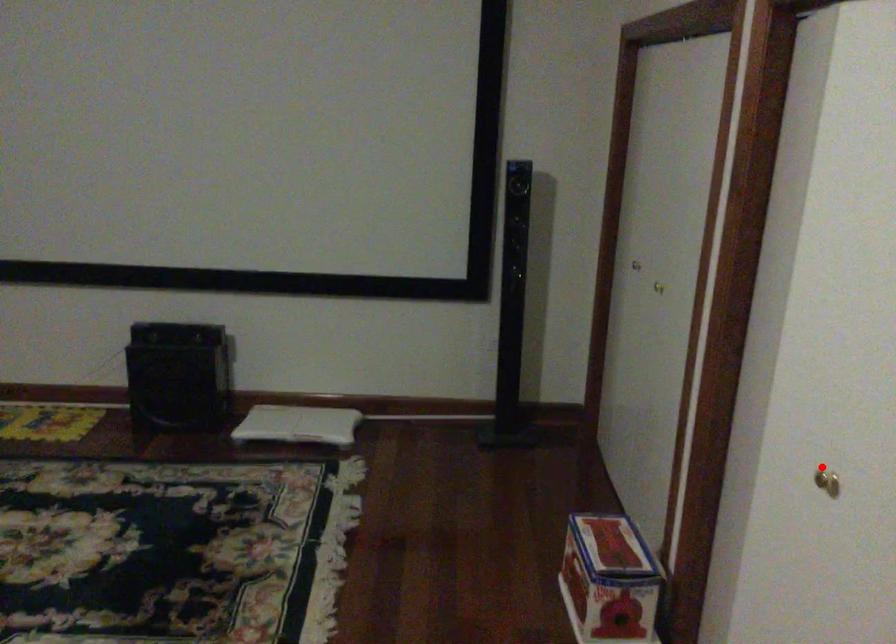
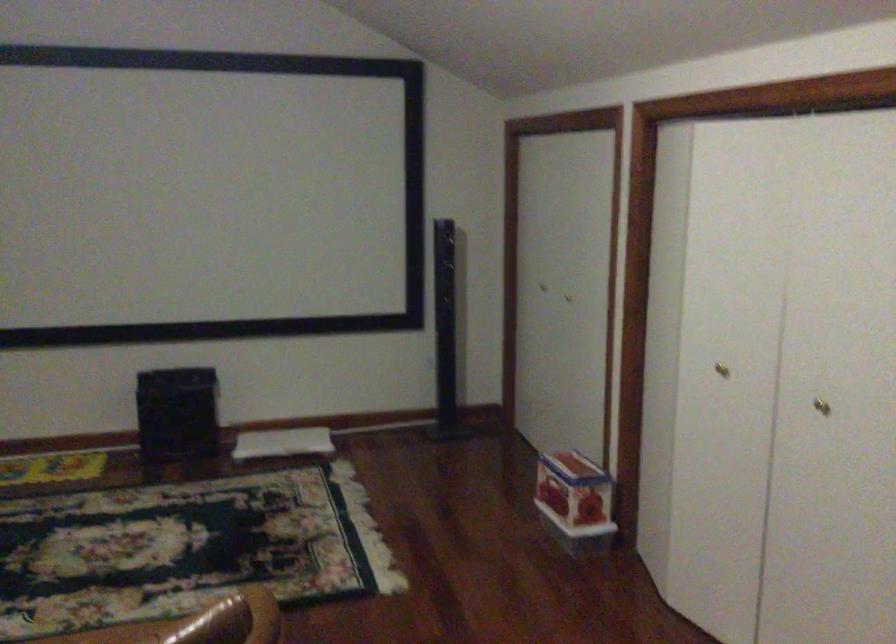
Locate, in the second image, the point that corresponds to the highlighted location in the first image.

(721, 368)